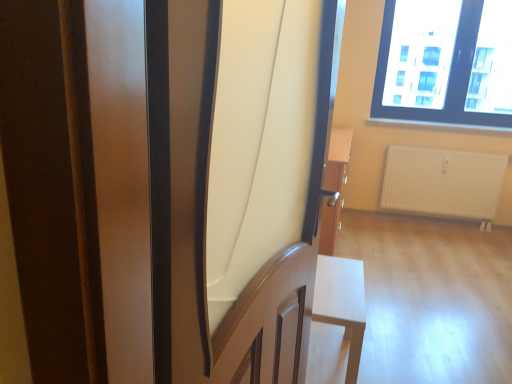
The width and height of the screenshot is (512, 384). In order to click on free point above white matte table at lower right (from a real-world perspective) in this screenshot , I will do `click(345, 286)`.